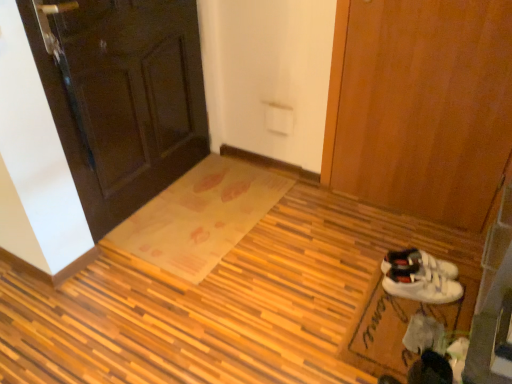
You are a GUI agent. You are given a task and a screenshot of the screen. Output one action in this format:
    pyautogui.click(x=<x>, y=<y>)
    Task: Click on the vacant space in between wooden door at right, the 2th door positioned from the left, and translucent plastic doormat at center, the 2th doormat in the front-to-back sequence
    
    Given the screenshot: What is the action you would take?
    pyautogui.click(x=339, y=237)